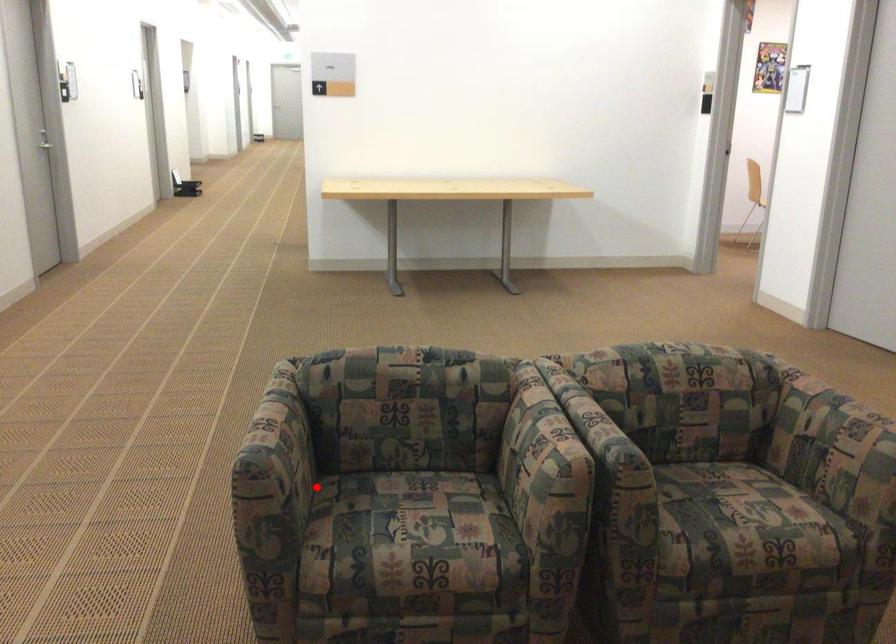
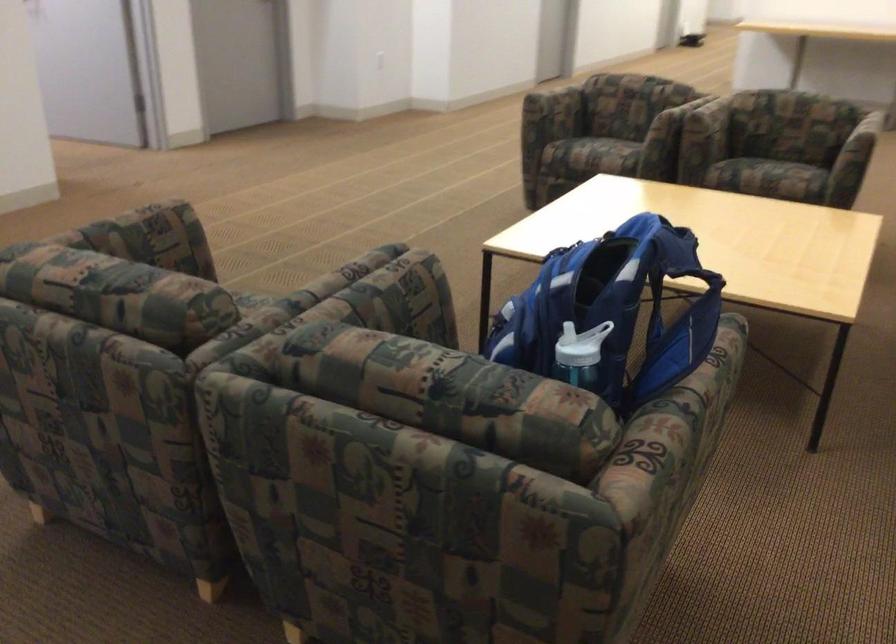
Question: I am providing you with two images of the same scene from different viewpoints. Given a red point in image1, look at the same physical point in image2. Is it:

Choices:
 (A) Closer to the viewpoint
 (B) Farther from the viewpoint

Answer: (B)